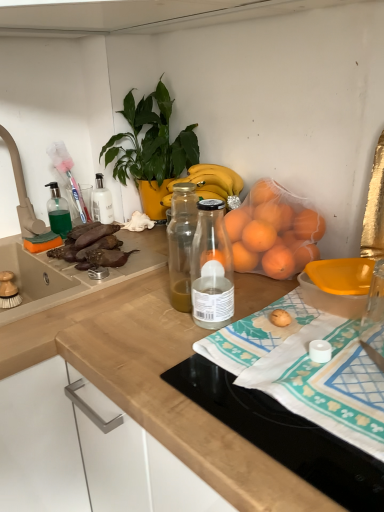
Question: In the image, is green plastic faucet at upper left positioned in front of or behind wooden at upper right, the 1th countertop when ordered from right to left?

Choices:
 (A) front
 (B) behind

Answer: (B)

Question: From a real-world perspective, is green plastic faucet at upper left above or below wooden at upper right, the 1th countertop when ordered from right to left?

Choices:
 (A) above
 (B) below

Answer: (A)

Question: Estimate the real-world distances between objects in this image. Which object is farther from the green plastic faucet at upper left?

Choices:
 (A) wooden at upper right, positioned as the second countertop in left-to-right order
 (B) green glossy plant at upper center
 (C) wooden at center, which is the second countertop in right-to-left order
 (D) yellow plastic bowl at lower right
 (E) green translucent soap dispenser at left

Answer: (D)

Question: Based on their relative distances, which object is farther from the green translucent soap dispenser at left?

Choices:
 (A) brown matte eggplant at left
 (B) wooden at center, the first countertop when ordered from left to right
 (C) green glossy plant at upper center
 (D) white cotton towel at center
 (E) yellow plastic bowl at lower right

Answer: (D)